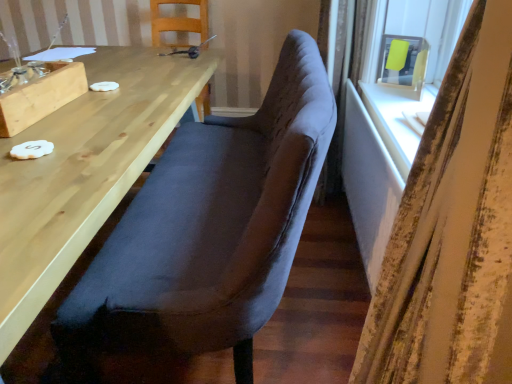
Question: Is velvet-like dark brown bench at center, acting as the first chair starting from the front, positioned before wooden table at left, which is the 1th table from left to right?

Choices:
 (A) no
 (B) yes

Answer: (A)

Question: From a real-world perspective, is velvet-like dark brown bench at center, acting as the first chair starting from the front, positioned over wooden table at left, which is the 1th table from left to right, based on gravity?

Choices:
 (A) no
 (B) yes

Answer: (B)

Question: Considering the relative sizes of velvet-like dark brown bench at center, the second chair positioned from the back, and wooden table at left, which is the 1th table from left to right, in the image provided, is velvet-like dark brown bench at center, the second chair positioned from the back, wider than wooden table at left, which is the 1th table from left to right,?

Choices:
 (A) yes
 (B) no

Answer: (B)

Question: Is wooden table at left, placed as the 2th table when sorted from right to left, surrounded by velvet-like dark brown bench at center, acting as the first chair starting from the front?

Choices:
 (A) no
 (B) yes

Answer: (A)

Question: From the image's perspective, does velvet-like dark brown bench at center, the second chair positioned from the back, appear lower than wooden table at left, placed as the 2th table when sorted from right to left?

Choices:
 (A) no
 (B) yes

Answer: (B)

Question: From the image's perspective, is matte yellow paper at upper right located above or below wooden table at left, placed as the 2th table when sorted from right to left?

Choices:
 (A) above
 (B) below

Answer: (A)

Question: In the image, is matte yellow paper at upper right on the left side or the right side of wooden table at left, which is the 1th table from left to right?

Choices:
 (A) right
 (B) left

Answer: (A)

Question: Do you think matte yellow paper at upper right is within wooden table at left, placed as the 2th table when sorted from right to left, or outside of it?

Choices:
 (A) outside
 (B) inside

Answer: (A)

Question: Is matte yellow paper at upper right wider or thinner than wooden table at left, which is the 1th table from left to right?

Choices:
 (A) wide
 (B) thin

Answer: (B)

Question: In the image, is white textured curtain at right positioned in front of or behind velvet-like dark brown bench at center, the second chair positioned from the back?

Choices:
 (A) behind
 (B) front

Answer: (B)

Question: In terms of height, does white textured curtain at right look taller or shorter compared to velvet-like dark brown bench at center, acting as the first chair starting from the front?

Choices:
 (A) short
 (B) tall

Answer: (B)

Question: Looking at their shapes, would you say white textured curtain at right is wider or thinner than velvet-like dark brown bench at center, the second chair positioned from the back?

Choices:
 (A) thin
 (B) wide

Answer: (A)

Question: From a real-world perspective, is white textured curtain at right positioned above or below velvet-like dark brown bench at center, acting as the first chair starting from the front?

Choices:
 (A) below
 (B) above

Answer: (B)

Question: From a real-world perspective, relative to white textured curtain at right, is wooden table at left, placed as the 2th table when sorted from right to left, vertically above or below?

Choices:
 (A) below
 (B) above

Answer: (A)

Question: Considering the relative positions of wooden table at left, which is the 1th table from left to right, and white textured curtain at right in the image provided, is wooden table at left, which is the 1th table from left to right, to the left or to the right of white textured curtain at right?

Choices:
 (A) right
 (B) left

Answer: (B)